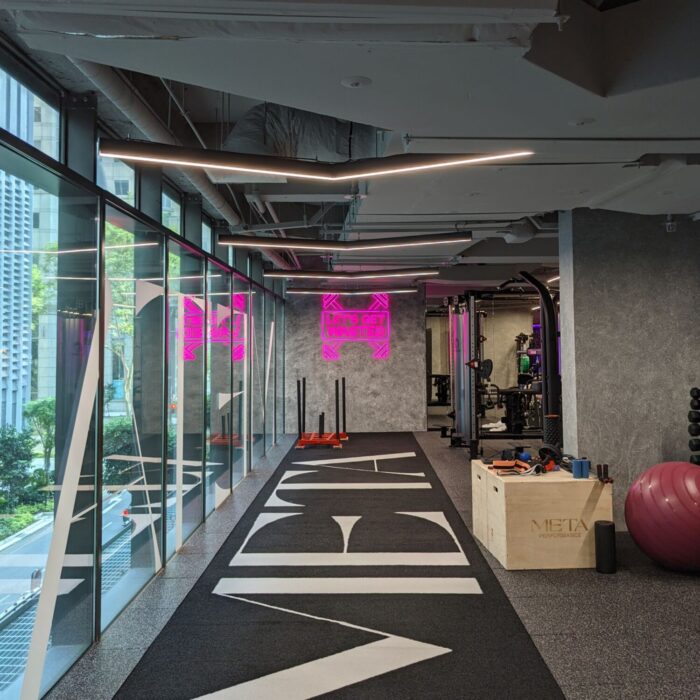
You are a GUI agent. You are given a task and a screenshot of the screen. Output one action in this format:
    pyautogui.click(x=<x>, y=<y>)
    Task: Click on the narrow top window panes
    
    Given the screenshot: What is the action you would take?
    pyautogui.click(x=26, y=122), pyautogui.click(x=108, y=173), pyautogui.click(x=173, y=208), pyautogui.click(x=204, y=241), pyautogui.click(x=227, y=256), pyautogui.click(x=246, y=269), pyautogui.click(x=262, y=276), pyautogui.click(x=276, y=284)